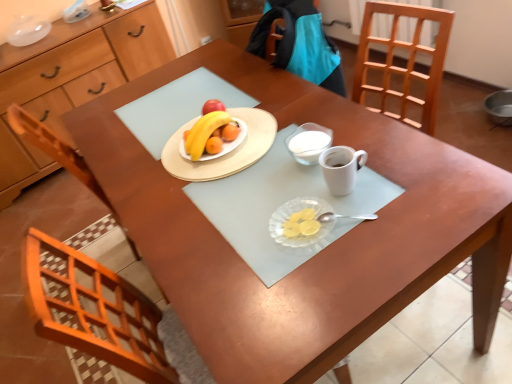
The width and height of the screenshot is (512, 384). Identify the location of vacant space behind matte wooden plate at center. (200, 89).